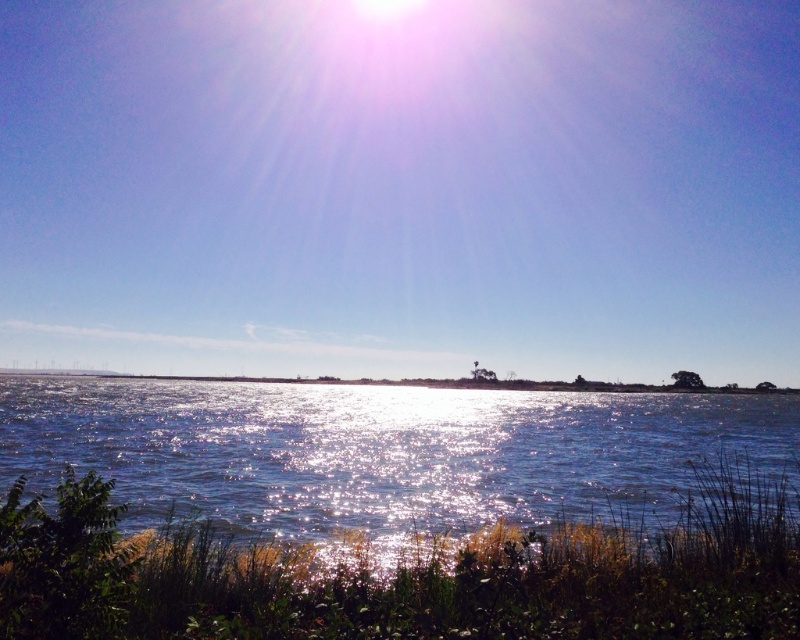
You are standing at the lakeside and looking at the bright blue sky at upper center and the sparkling blue water at center. Which object is located higher in the image?

The bright blue sky at upper center is located higher in the image than the sparkling blue water at center.

You are standing at the lakeside and want to estimate how far the bright blue sky at upper center is from you. Can you provide an approximate distance?

The bright blue sky at upper center is approximately 222.89 meters away from the viewer.

You are an artist planning to paint the lakeside scene. You want to ensure the bright blue sky at upper center and sparkling blue water at center are proportionally accurate. Which of these two elements should you make wider in your painting?

The bright blue sky at upper center should be made wider in the painting since its width is larger than the sparkling blue water at center according to the scene description.